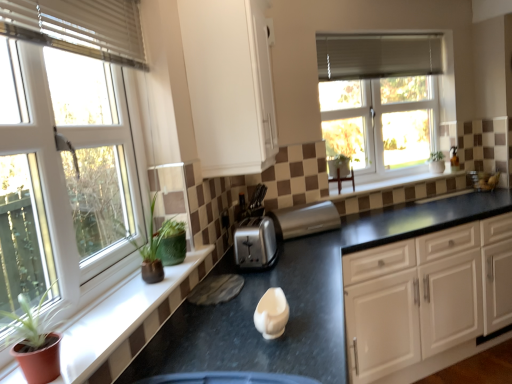
Question: Is black granite countertop at center inside white matte cabinet at upper center, the first cabinetry positioned from the top?

Choices:
 (A) no
 (B) yes

Answer: (A)

Question: Is white matte cabinet at upper center, positioned as the 2th cabinetry in bottom-to-top order, positioned with its back to black granite countertop at center?

Choices:
 (A) yes
 (B) no

Answer: (B)

Question: Considering the relative positions of white matte cabinet at upper center, arranged as the second cabinetry when viewed from the right, and black granite countertop at center in the image provided, is white matte cabinet at upper center, arranged as the second cabinetry when viewed from the right, to the right of black granite countertop at center from the viewer's perspective?

Choices:
 (A) yes
 (B) no

Answer: (B)

Question: Are white matte cabinet at upper center, the first cabinetry positioned from the top, and black granite countertop at center making contact?

Choices:
 (A) no
 (B) yes

Answer: (A)

Question: From a real-world perspective, is white matte cabinet at upper center, which ranks as the 1th cabinetry in left-to-right order, located higher than black granite countertop at center?

Choices:
 (A) yes
 (B) no

Answer: (A)

Question: Can you confirm if white matte cabinet at upper center, which ranks as the 1th cabinetry in left-to-right order, is wider than black granite countertop at center?

Choices:
 (A) no
 (B) yes

Answer: (A)

Question: Is green matte plant at left thinner than satin silver toaster at center, marked as the 1th appliance in a front-to-back arrangement?

Choices:
 (A) no
 (B) yes

Answer: (B)

Question: Can you confirm if green matte plant at left is smaller than satin silver toaster at center, the second appliance viewed from the right?

Choices:
 (A) yes
 (B) no

Answer: (A)

Question: From the image's perspective, is green matte plant at left on top of satin silver toaster at center, which is the first appliance from left to right?

Choices:
 (A) no
 (B) yes

Answer: (A)

Question: From the image's perspective, is green matte plant at left beneath satin silver toaster at center, which is the first appliance from left to right?

Choices:
 (A) no
 (B) yes

Answer: (B)

Question: From a real-world perspective, is green matte plant at left physically above satin silver toaster at center, the second appliance viewed from the right?

Choices:
 (A) no
 (B) yes

Answer: (B)

Question: Is satin silver toaster at center, which is the first appliance from left to right, at the back of green matte plant at left?

Choices:
 (A) yes
 (B) no

Answer: (B)

Question: Is white plastic window at left, which is counted as the second window, starting from the back, positioned far away from matte green plant at left?

Choices:
 (A) yes
 (B) no

Answer: (B)